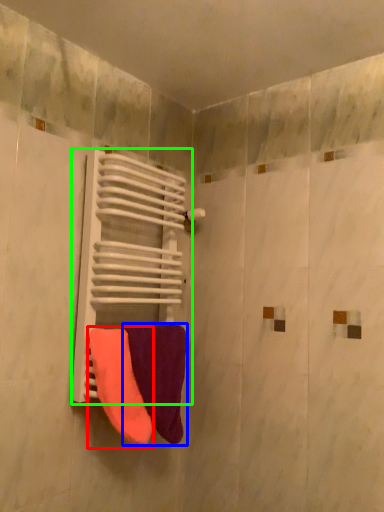
Question: Estimate the real-world distances between objects in this image. Which object is closer to towel (highlighted by a red box), towel (highlighted by a blue box) or radiator (highlighted by a green box)?

Choices:
 (A) towel
 (B) radiator

Answer: (A)